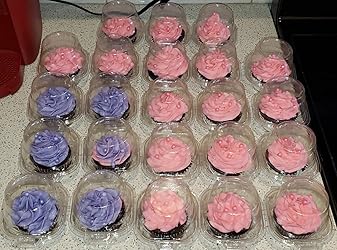
In order to click on black cord in this screenshot , I will do `click(90, 12)`.